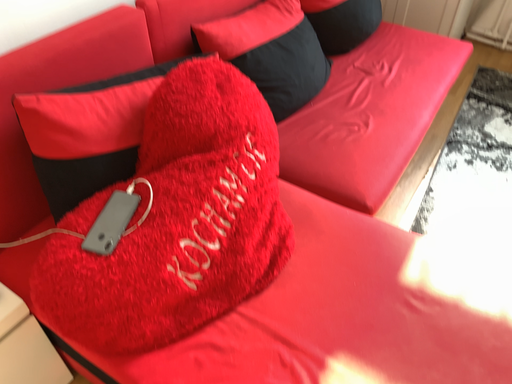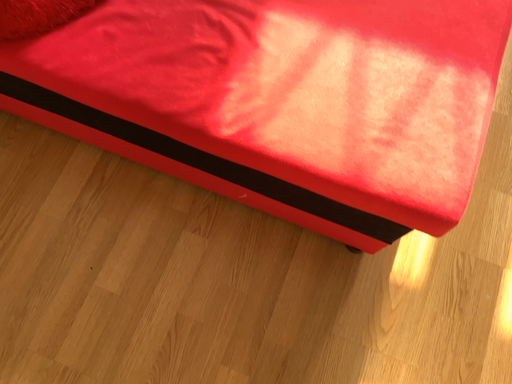
Question: Which way did the camera rotate in the video?

Choices:
 (A) rotated left
 (B) rotated right

Answer: (B)